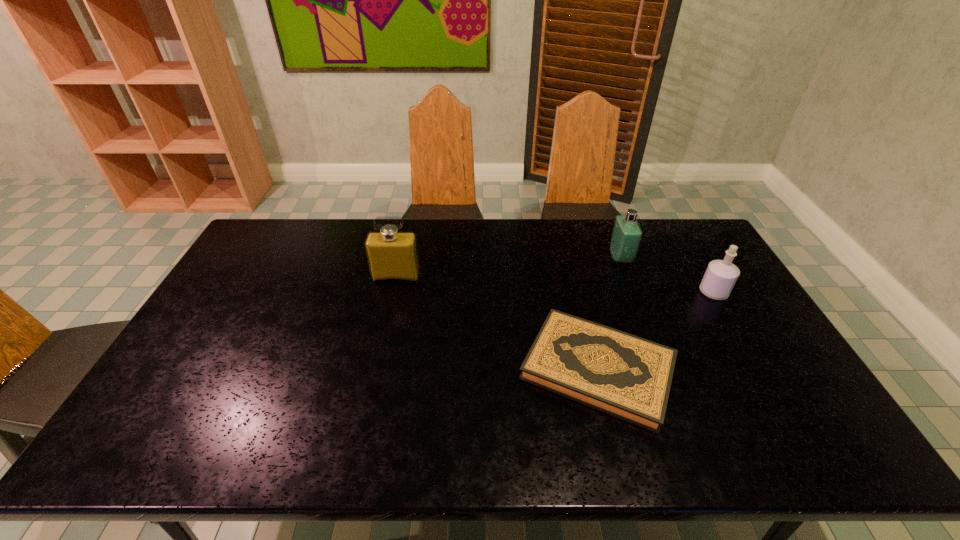
Find the location of a particular element. the second closest object to the farthest perfume is located at coordinates (628, 377).

Where is `perfume identified as the third closest to the hardback book`? The height and width of the screenshot is (540, 960). perfume identified as the third closest to the hardback book is located at coordinates [x=392, y=255].

Locate which perfume ranks second in proximity to the farthest object. Please provide its 2D coordinates. Your answer should be formatted as a tuple, i.e. [(x, y)], where the tuple contains the x and y coordinates of a point satisfying the conditions above.

[(392, 255)]

This screenshot has height=540, width=960. What are the coordinates of `vacant area that satisfies the following two spatial constraints: 1. on the front-facing side of the leftmost object; 2. on the right side of the rightmost object` in the screenshot? It's located at (393, 292).

The height and width of the screenshot is (540, 960). I want to click on free location that satisfies the following two spatial constraints: 1. on the front-facing side of the rightmost perfume; 2. on the left side of the leftmost perfume, so click(393, 292).

The width and height of the screenshot is (960, 540). Identify the location of vacant space that satisfies the following two spatial constraints: 1. on the back side of the shortest object; 2. on the left side of the rightmost object. (579, 292).

I want to click on vacant region that satisfies the following two spatial constraints: 1. on the front label of the farthest object; 2. on the right side of the rightmost perfume, so click(634, 292).

At what (x,y) coordinates should I click in order to perform the action: click on blank area in the image that satisfies the following two spatial constraints: 1. on the front label of the farthest object; 2. on the front-facing side of the leftmost object. Please return your answer as a coordinate pair (x, y). The height and width of the screenshot is (540, 960). Looking at the image, I should click on (628, 277).

This screenshot has height=540, width=960. Find the location of `free spot that satisfies the following two spatial constraints: 1. on the front-facing side of the shortest object; 2. on the right side of the leftmost perfume`. free spot that satisfies the following two spatial constraints: 1. on the front-facing side of the shortest object; 2. on the right side of the leftmost perfume is located at coordinates (376, 369).

Where is `free space in the image that satisfies the following two spatial constraints: 1. on the front-facing side of the nearest object; 2. on the left side of the leftmost object`? The width and height of the screenshot is (960, 540). free space in the image that satisfies the following two spatial constraints: 1. on the front-facing side of the nearest object; 2. on the left side of the leftmost object is located at coordinates (376, 369).